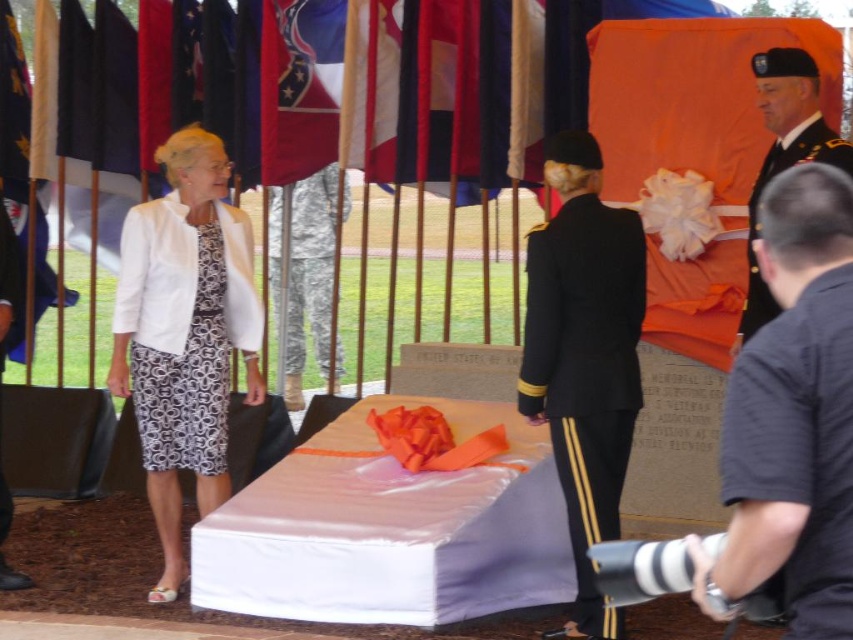
Looking at this image, is white textured dress at center thinner than dark blue cotton t-shirt at lower right?

No.

Does white textured dress at center appear on the left side of dark blue cotton t-shirt at lower right?

Correct, you'll find white textured dress at center to the left of dark blue cotton t-shirt at lower right.

At what (x,y) coordinates should I click in order to perform the action: click on white textured dress at center. Please return your answer as a coordinate pair (x, y). Looking at the image, I should click on (184, 333).

Is orange fabric flag at upper center to the left of dark blue cotton t-shirt at lower right from the viewer's perspective?

No, orange fabric flag at upper center is not to the left of dark blue cotton t-shirt at lower right.

Is the position of orange fabric flag at upper center more distant than that of dark blue cotton t-shirt at lower right?

Yes, it is.

Which is in front, point (718, 74) or point (837, 388)?

Point (837, 388) is more forward.

In order to click on orange fabric flag at upper center in this screenshot , I will do `click(694, 148)`.

Can you confirm if dark blue cotton t-shirt at lower right is wider than camouflage fabric uniform at center?

No.

Can you confirm if dark blue cotton t-shirt at lower right is positioned below camouflage fabric uniform at center?

Indeed, dark blue cotton t-shirt at lower right is positioned under camouflage fabric uniform at center.

Locate an element on the screen. This screenshot has height=640, width=853. dark blue cotton t-shirt at lower right is located at coordinates (799, 449).